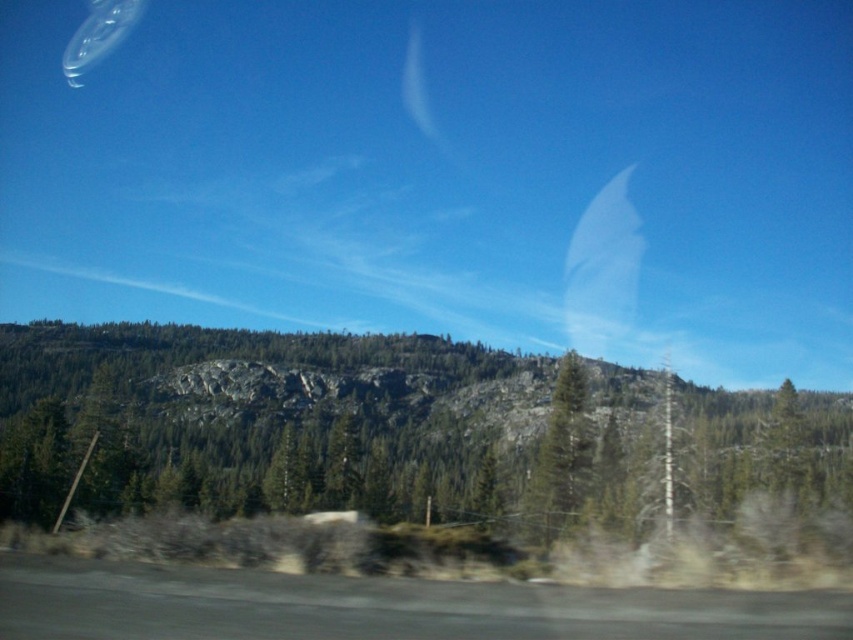
Question: Which of the following is the closest to the observer?

Choices:
 (A) green matte tree at center
 (B) green textured tree at center

Answer: (B)

Question: Which object appears farthest from the camera in this image?

Choices:
 (A) green matte tree at center
 (B) green textured tree at center

Answer: (A)

Question: Is green textured tree at center wider than green matte tree at center?

Choices:
 (A) yes
 (B) no

Answer: (A)

Question: Where is green textured tree at center located in relation to green matte tree at center in the image?

Choices:
 (A) above
 (B) below

Answer: (A)

Question: Among these points, which one is farthest from the camera?

Choices:
 (A) (544, 516)
 (B) (527, 422)

Answer: (B)

Question: Observing the image, what is the correct spatial positioning of green textured tree at center in reference to green matte tree at center?

Choices:
 (A) below
 (B) above

Answer: (B)